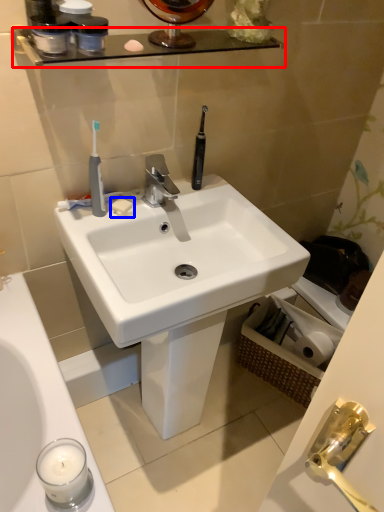
Question: Which object appears closest to the camera in this image, balustrade (highlighted by a red box) or soap (highlighted by a blue box)?

Choices:
 (A) balustrade
 (B) soap

Answer: (A)